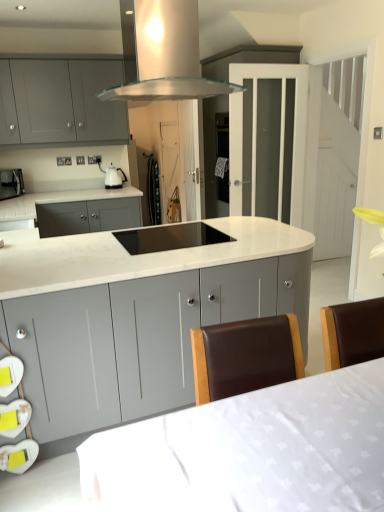
Question: Is black glass cooktop at center placed right next to matte black microwave at left?

Choices:
 (A) no
 (B) yes

Answer: (A)

Question: From a real-world perspective, is black glass cooktop at center located beneath matte black microwave at left?

Choices:
 (A) yes
 (B) no

Answer: (A)

Question: Is the depth of black glass cooktop at center greater than that of matte black microwave at left?

Choices:
 (A) no
 (B) yes

Answer: (A)

Question: Is black glass cooktop at center at the right side of matte black microwave at left?

Choices:
 (A) yes
 (B) no

Answer: (A)

Question: From the image's perspective, is black glass cooktop at center located beneath matte black microwave at left?

Choices:
 (A) yes
 (B) no

Answer: (A)

Question: Is black glass cooktop at center wider than matte black microwave at left?

Choices:
 (A) no
 (B) yes

Answer: (B)

Question: Would you say white fabric table at lower center is outside black glass cooktop at center?

Choices:
 (A) yes
 (B) no

Answer: (A)

Question: Is white fabric table at lower center oriented towards black glass cooktop at center?

Choices:
 (A) no
 (B) yes

Answer: (B)

Question: Is white fabric table at lower center positioned behind black glass cooktop at center?

Choices:
 (A) no
 (B) yes

Answer: (A)

Question: From a real-world perspective, does white fabric table at lower center stand above black glass cooktop at center?

Choices:
 (A) no
 (B) yes

Answer: (A)

Question: Is white fabric table at lower center smaller than black glass cooktop at center?

Choices:
 (A) yes
 (B) no

Answer: (B)

Question: Is white fabric table at lower center in front of black glass cooktop at center?

Choices:
 (A) yes
 (B) no

Answer: (A)

Question: Is matte gray cabinets at upper left, the second cabinetry ordered from the bottom, looking in the opposite direction of transparent glass range hood at upper center?

Choices:
 (A) yes
 (B) no

Answer: (B)